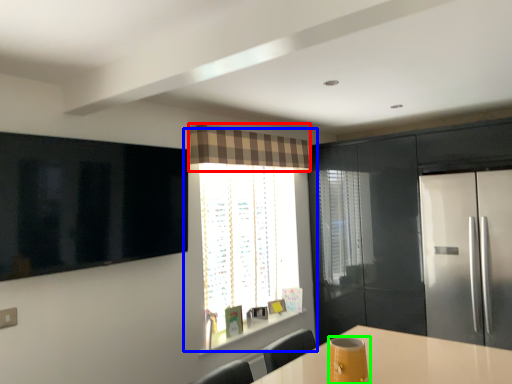
Question: Estimate the real-world distances between objects in this image. Which object is closer to curtain (highlighted by a red box), window (highlighted by a blue box) or appliance (highlighted by a green box)?

Choices:
 (A) window
 (B) appliance

Answer: (A)